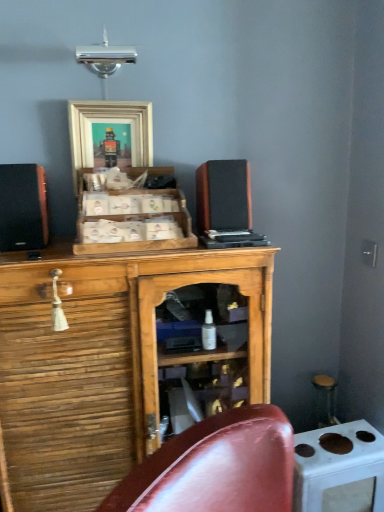
Question: Looking at the image, does wooden speaker at center, the 2th speaker viewed from the left, seem bigger or smaller compared to wooden framed picture at upper center?

Choices:
 (A) big
 (B) small

Answer: (A)

Question: From the image's perspective, relative to wooden framed picture at upper center, is wooden speaker at center, the 2th speaker viewed from the left, above or below?

Choices:
 (A) below
 (B) above

Answer: (A)

Question: Which object is positioned farthest from the wooden cabinet at center, the first cabinetry positioned from the bottom?

Choices:
 (A) matte black speaker at left, which ranks as the second speaker in right-to-left order
 (B) white glossy stove at lower right
 (C) wooden framed picture at upper center
 (D) wooden crate at center, which appears as the first cabinetry when viewed from the top
 (E) wooden speaker at center, the 2th speaker viewed from the left

Answer: (C)

Question: Considering the real-world distances, which object is closest to the wooden framed picture at upper center?

Choices:
 (A) white glossy stove at lower right
 (B) wooden speaker at center, the 2th speaker viewed from the left
 (C) wooden cabinet at center, the first cabinetry positioned from the bottom
 (D) wooden bar stool at right
 (E) wooden crate at center, which appears as the first cabinetry when viewed from the top

Answer: (E)